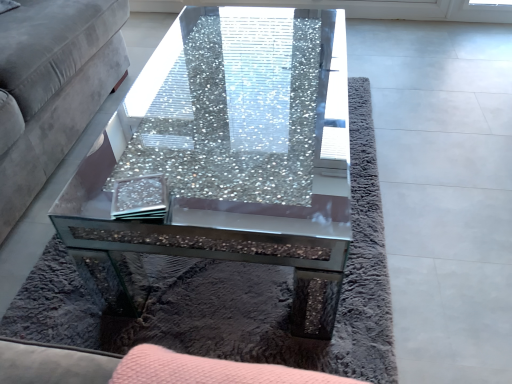
Question: Is there a large distance between clear glass coaster at center and velvet grey couch at left?

Choices:
 (A) yes
 (B) no

Answer: (B)

Question: Considering the relative sizes of clear glass coaster at center and velvet grey couch at left in the image provided, is clear glass coaster at center shorter than velvet grey couch at left?

Choices:
 (A) yes
 (B) no

Answer: (A)

Question: Does clear glass coaster at center appear on the right side of velvet grey couch at left?

Choices:
 (A) no
 (B) yes

Answer: (B)

Question: Is clear glass coaster at center not inside velvet grey couch at left?

Choices:
 (A) yes
 (B) no

Answer: (A)

Question: Does clear glass coaster at center have a lesser width compared to velvet grey couch at left?

Choices:
 (A) yes
 (B) no

Answer: (A)

Question: From a real-world perspective, is clear glass coaster at center physically below velvet grey couch at left?

Choices:
 (A) yes
 (B) no

Answer: (B)

Question: Can you confirm if crushed glass coffee table at center is shorter than clear glass coaster at center?

Choices:
 (A) no
 (B) yes

Answer: (A)

Question: Considering the relative positions of crushed glass coffee table at center and clear glass coaster at center in the image provided, is crushed glass coffee table at center to the right of clear glass coaster at center from the viewer's perspective?

Choices:
 (A) no
 (B) yes

Answer: (B)

Question: From the image's perspective, is crushed glass coffee table at center under clear glass coaster at center?

Choices:
 (A) yes
 (B) no

Answer: (B)

Question: Is crushed glass coffee table at center directly adjacent to clear glass coaster at center?

Choices:
 (A) no
 (B) yes

Answer: (A)

Question: Is crushed glass coffee table at center smaller than clear glass coaster at center?

Choices:
 (A) no
 (B) yes

Answer: (A)

Question: Is there a large distance between crushed glass coffee table at center and clear glass coaster at center?

Choices:
 (A) no
 (B) yes

Answer: (A)

Question: Is clear glass coaster at center taller than crushed glass coffee table at center?

Choices:
 (A) yes
 (B) no

Answer: (B)